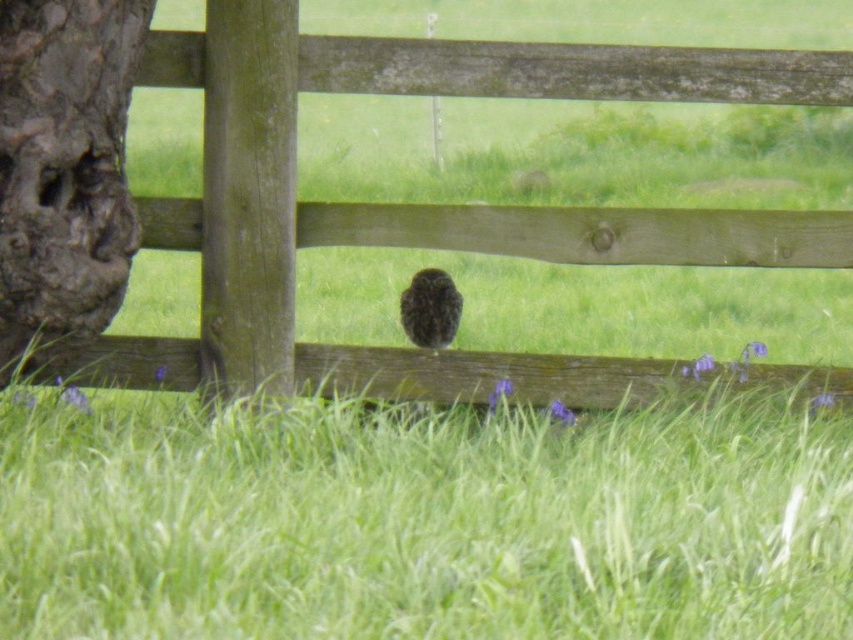
You are standing in the middle of the green grass at center. Looking around, you see a small owl perched on a wooden fence. Where is the owl positioned relative to your location?

The owl is positioned centrally within the frame, facing away from the viewer, so it is likely directly in front of you if you are standing in the middle of the green grass at center.

You are a photographer trying to capture the dark brown owl at center in the image. You notice the green grass at center is blocking part of the owl. Can you adjust your position to avoid the grass?

The green grass at center is larger in size than the dark brown owl at center, so adjusting your position might help avoid the grass obstruction.